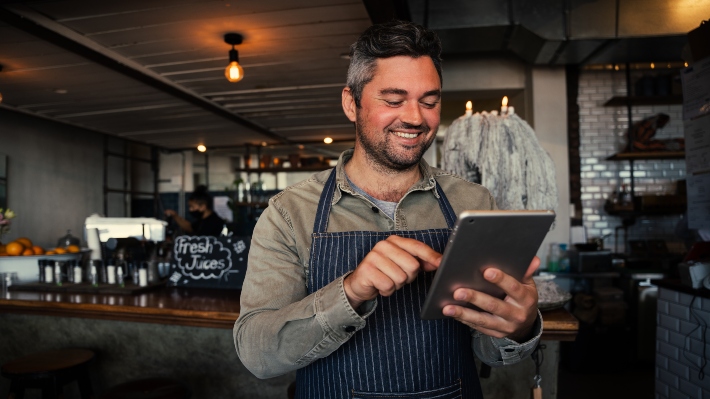
Identify the location of brick tiles. Image resolution: width=710 pixels, height=399 pixels. (601, 121), (603, 176), (655, 173), (672, 328), (684, 358).